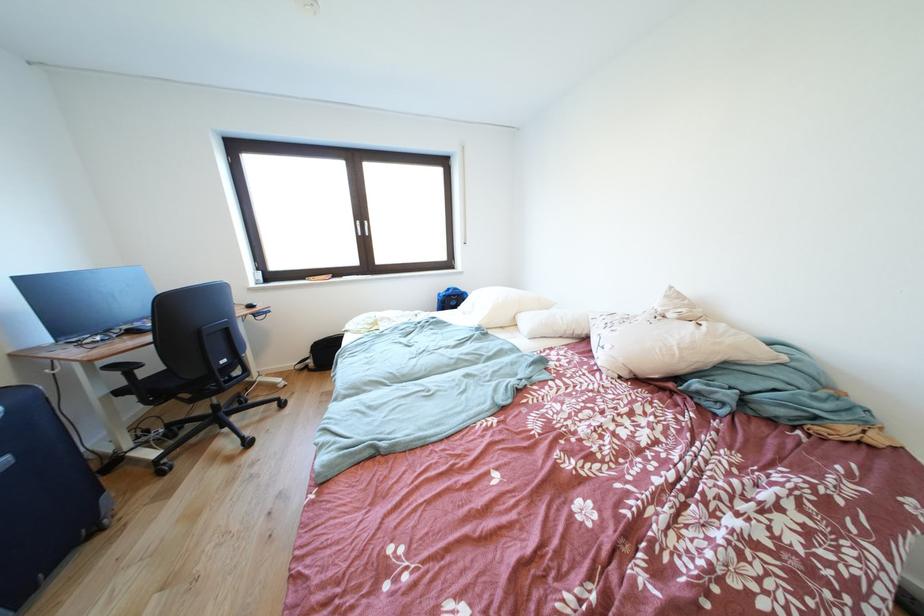
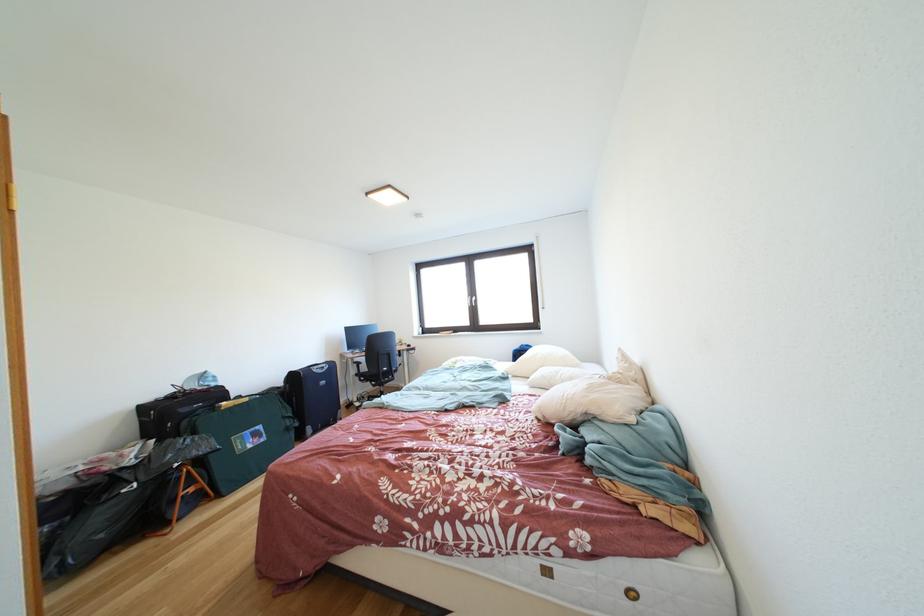
Find the pixel in the second image that matches (x=464, y=294) in the first image.

(535, 351)